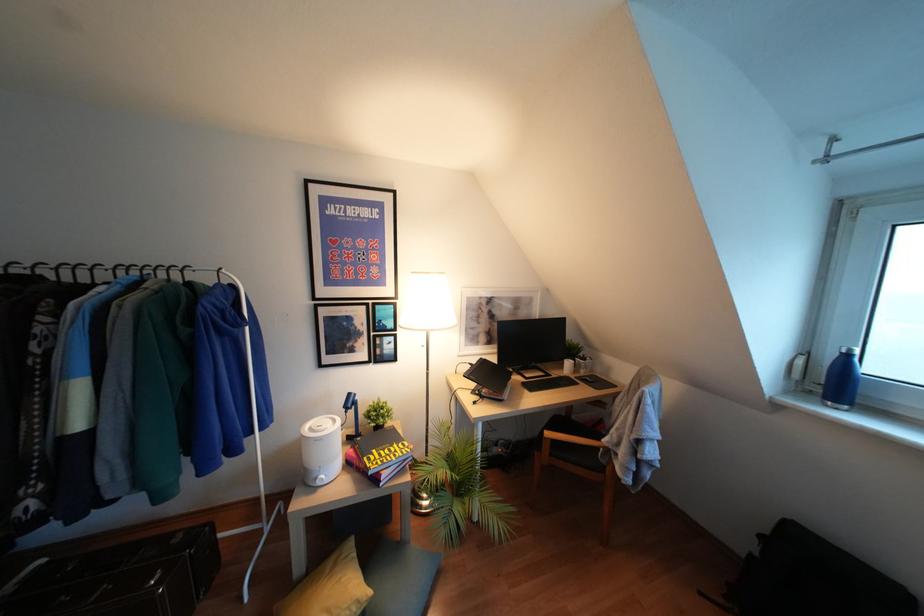
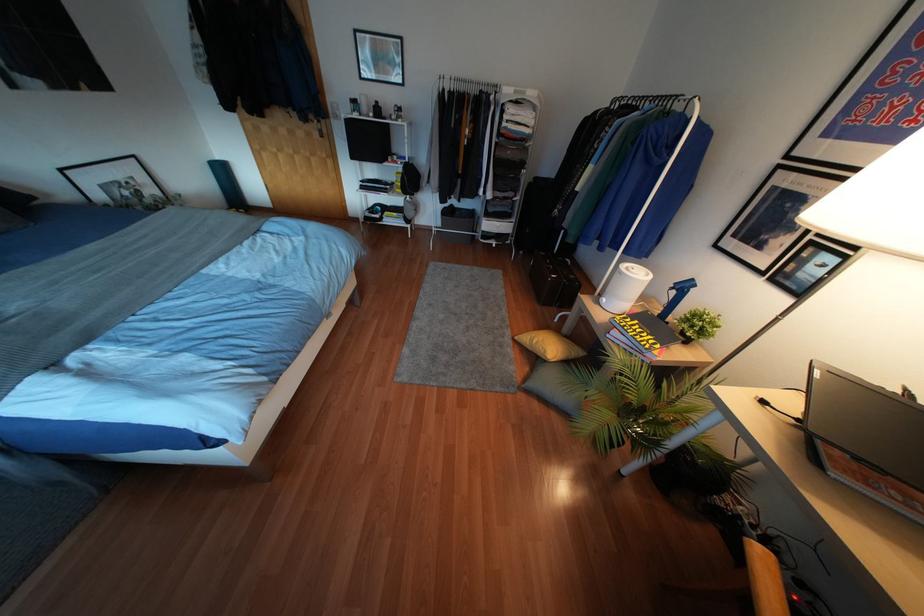
Locate, in the second image, the point that corresponds to pixel 177 537 in the first image.

(572, 277)